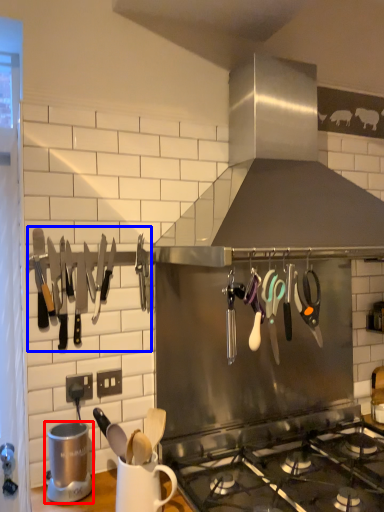
Question: Among these objects, which one is nearest to the camera, appliance (highlighted by a red box) or cutlery (highlighted by a blue box)?

Choices:
 (A) appliance
 (B) cutlery

Answer: (A)